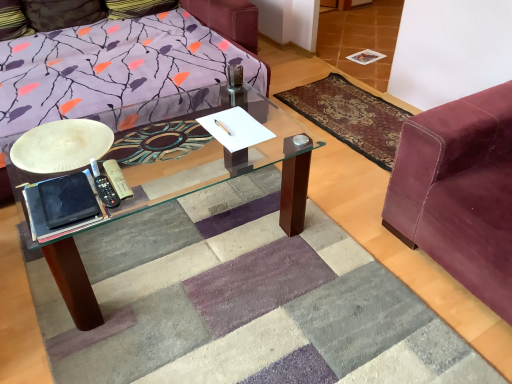
At what (x,y) coordinates should I click in order to perform the action: click on blank space situated above white matte plate at left (from a real-world perspective). Please return your answer as a coordinate pair (x, y). Looking at the image, I should click on (59, 141).